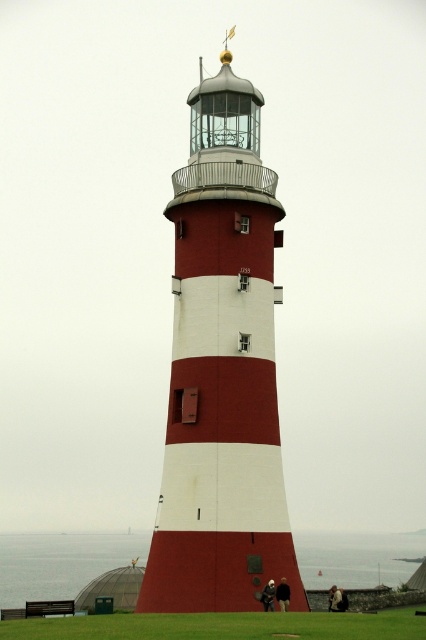
You are a painter planning to paint a lighthouse scene. You need to ensure the lighthouse at the center is narrower than the grass area at the bottom. Based on the scene description, does the smooth painted lighthouse at center meet this requirement compared to the green grass at lower center?

Yes, the smooth painted lighthouse at center has a width less than green grass at lower center, so it meets the requirement.

You are an inspector checking the lighthouse structure. You have a point marked at coordinates point (221, 371). According to the image, what is the surface texture at this point on the lighthouse?

The point (221, 371) is on smooth painted lighthouse at center, so the surface texture there is smooth and painted.